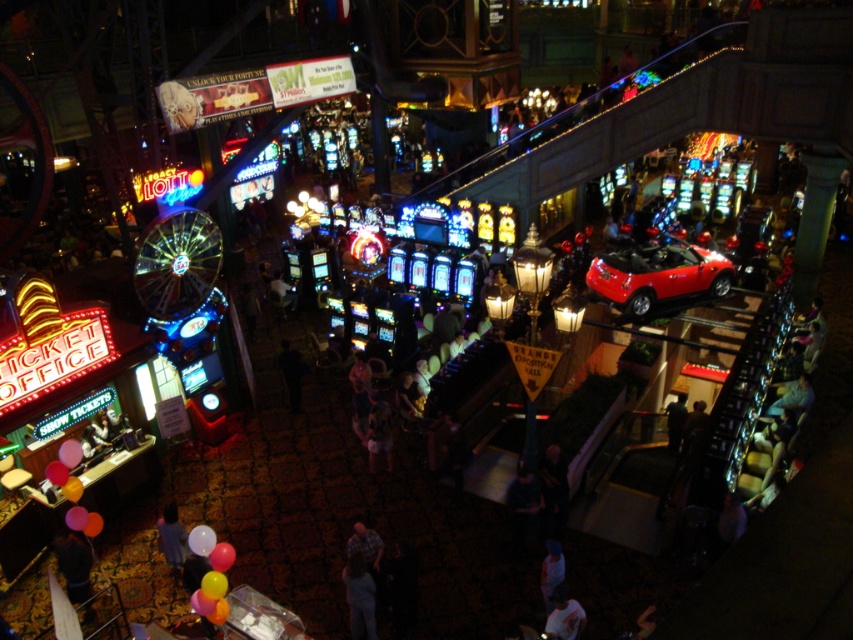
Based on the photo, you are a photographer standing in the casino scene. You want to take a photo of the light blue fabric shirt at lower left and the translucent rubber balloon at lower left. Which object should you focus on first to ensure it appears in the foreground?

The light blue fabric shirt at lower left is below the translucent rubber balloon at lower left, so the translucent rubber balloon at lower left is closer to you. Therefore, you should focus on the translucent rubber balloon at lower left first to capture it in the foreground.

You are a security guard in the casino and need to place a new security camera. The camera needs to be positioned so that it can monitor both the shiny red convertible at center and the rubber balloon at lower center without obstruction. Considering their heights, where should the camera be placed?

The shiny red convertible at center is taller than the rubber balloon at lower center. To monitor both without obstruction, the camera should be placed above the shiny red convertible at center so it can overlook both objects.

You are standing in the casino and see a person wearing a dark blue shirt at lower center and another wearing a light blue fabric shirt at lower left. Which shirt is closer to the ground?

The dark blue shirt at lower center is closer to the ground because it is positioned below the light blue fabric shirt at lower left.